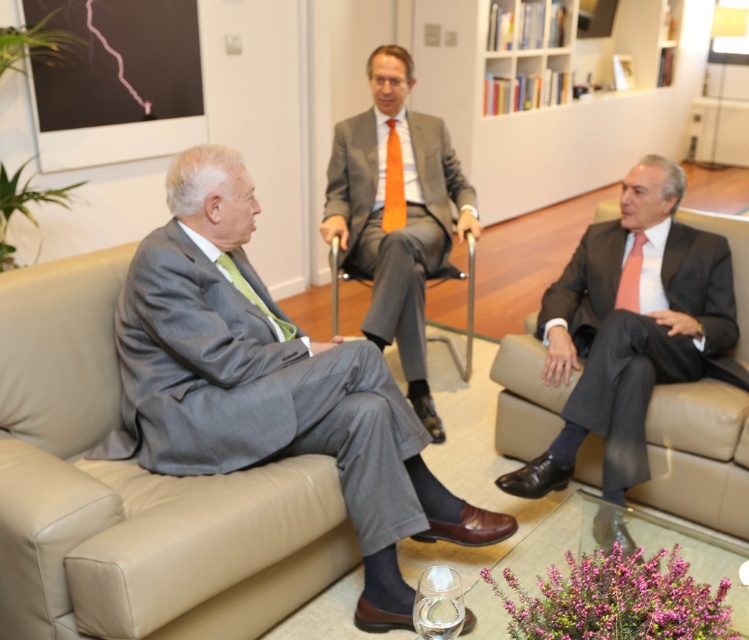
Does gray fabric suit at left appear on the left side of matte black suit at right?

Correct, you'll find gray fabric suit at left to the left of matte black suit at right.

Measure the distance from gray fabric suit at left to matte black suit at right.

gray fabric suit at left is 93.51 centimeters away from matte black suit at right.

This screenshot has width=749, height=640. Describe the element at coordinates (269, 387) in the screenshot. I see `gray fabric suit at left` at that location.

The width and height of the screenshot is (749, 640). I want to click on gray fabric suit at left, so click(x=269, y=387).

The height and width of the screenshot is (640, 749). I want to click on matte orange tie at right, so click(x=630, y=276).

Between matte orange tie at right and green silk tie at left, which one appears on the right side from the viewer's perspective?

Positioned to the right is matte orange tie at right.

Is point (634, 236) more distant than point (251, 296)?

Yes, point (634, 236) is behind point (251, 296).

Locate an element on the screen. Image resolution: width=749 pixels, height=640 pixels. matte orange tie at right is located at coordinates (630, 276).

How far apart are metallic gray chair at center and orange silk tie at center?

metallic gray chair at center and orange silk tie at center are 21.46 inches apart from each other.

Is metallic gray chair at center bigger than orange silk tie at center?

Yes.

Is point (470, 259) positioned before point (398, 144)?

Yes, it is.

You are a GUI agent. You are given a task and a screenshot of the screen. Output one action in this format:
    pyautogui.click(x=<x>, y=<y>)
    Task: Click on the metallic gray chair at center
    
    Given the screenshot: What is the action you would take?
    pyautogui.click(x=467, y=317)